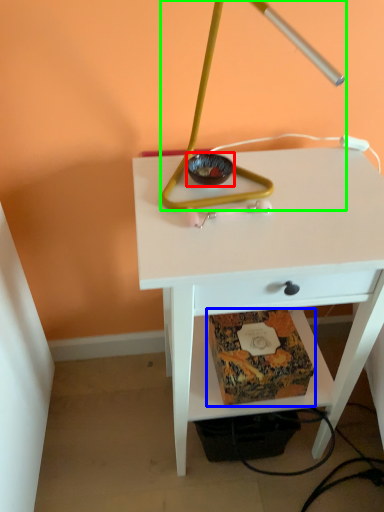
Question: Which object is positioned farthest from glass bowl (highlighted by a red box)? Select from paperback book (highlighted by a blue box) and lamp (highlighted by a green box).

Choices:
 (A) paperback book
 (B) lamp

Answer: (A)